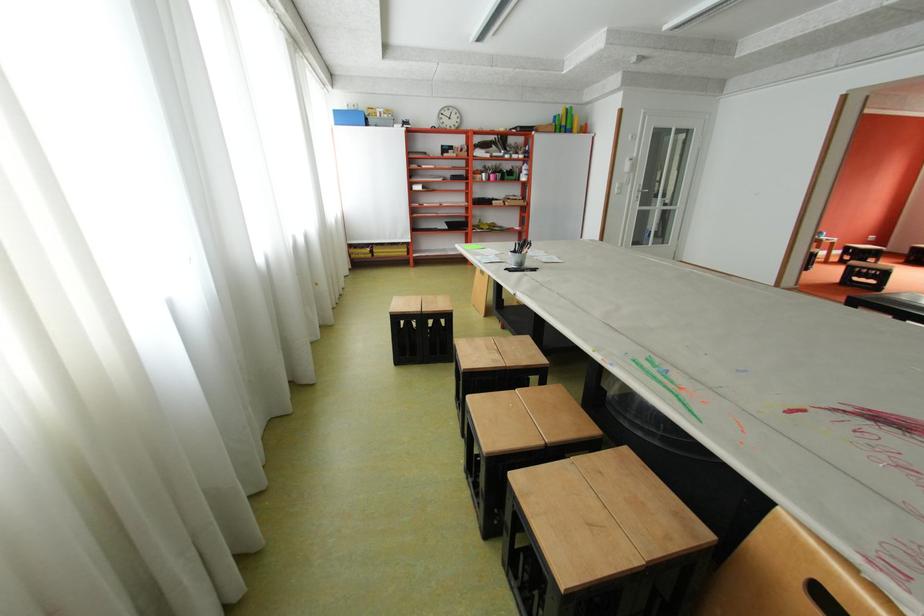
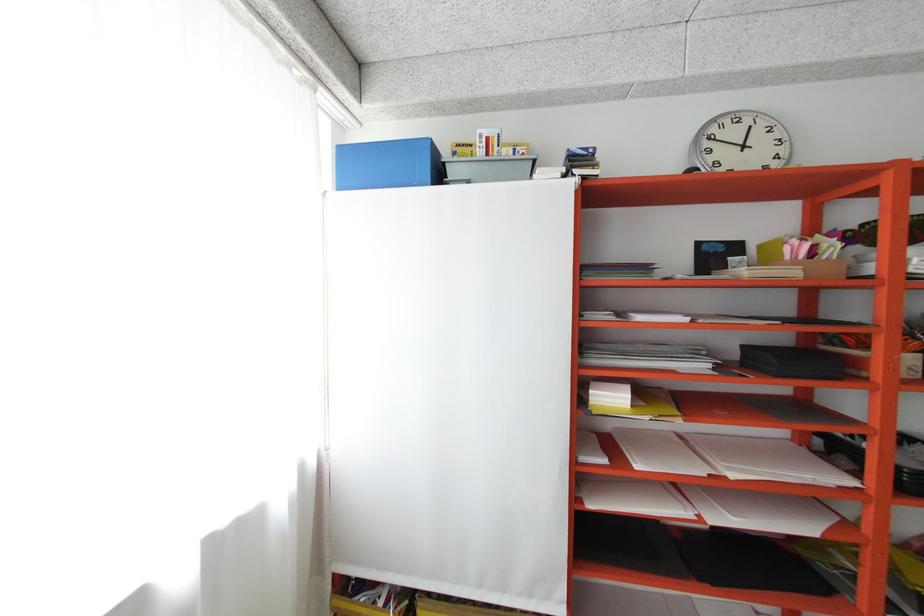
In the second image, find the point that corresponds to point 452,122 in the first image.

(720, 159)